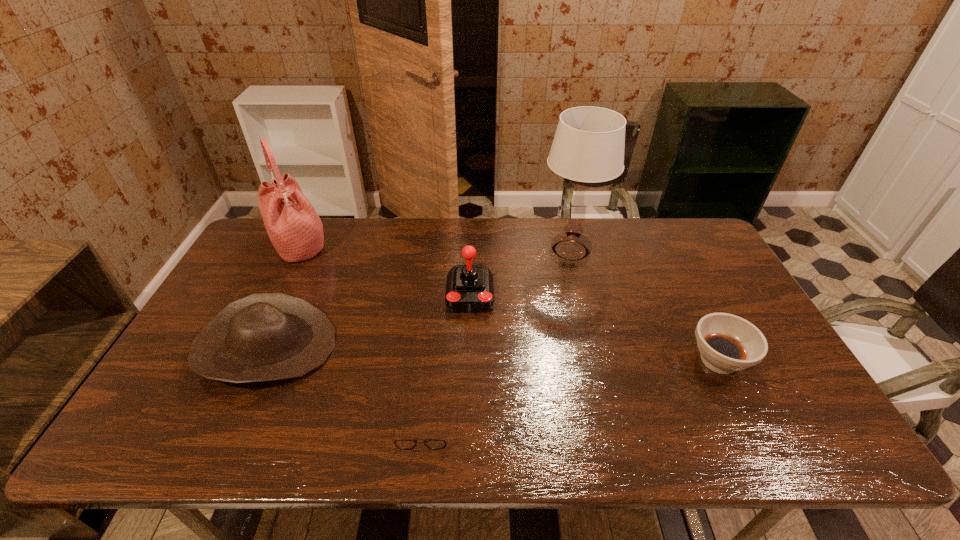
Find the location of a particular element. object at the right edge is located at coordinates (727, 343).

Image resolution: width=960 pixels, height=540 pixels. What are the coordinates of `object that is at the far left corner` in the screenshot? It's located at (295, 229).

In the image, there is a desktop. At what (x,y) coordinates should I click in order to perform the action: click on vacant space at the far edge. Please return your answer as a coordinate pair (x, y). Looking at the image, I should click on (456, 253).

Identify the location of vacant area at the near edge of the desktop. This screenshot has width=960, height=540. (609, 419).

Where is `blank space at the left edge`? The image size is (960, 540). blank space at the left edge is located at coordinates (256, 264).

This screenshot has height=540, width=960. In order to click on vacant space at the right edge in this screenshot , I will do `click(769, 364)`.

Locate an element on the screen. The height and width of the screenshot is (540, 960). free space at the far right corner of the desktop is located at coordinates (717, 259).

At what (x,y) coordinates should I click in order to perform the action: click on free spot between the handbag and the shortest object. Please return your answer as a coordinate pair (x, y). This screenshot has width=960, height=540. Looking at the image, I should click on (362, 334).

What are the coordinates of `free spot between the table lamp and the sunglasses` in the screenshot? It's located at (497, 336).

You are a GUI agent. You are given a task and a screenshot of the screen. Output one action in this format:
    pyautogui.click(x=<x>, y=<y>)
    Task: Click on the free space between the handbag and the sunglasses
    
    Given the screenshot: What is the action you would take?
    pyautogui.click(x=362, y=334)